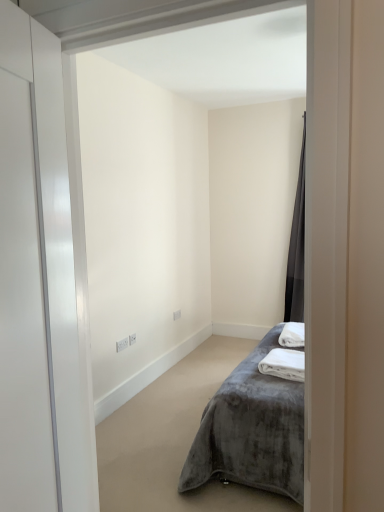
Locate an element on the screen. The width and height of the screenshot is (384, 512). free space above white plush bath towel at lower right, the first bath towel positioned from the back (from a real-world perspective) is located at coordinates (292, 329).